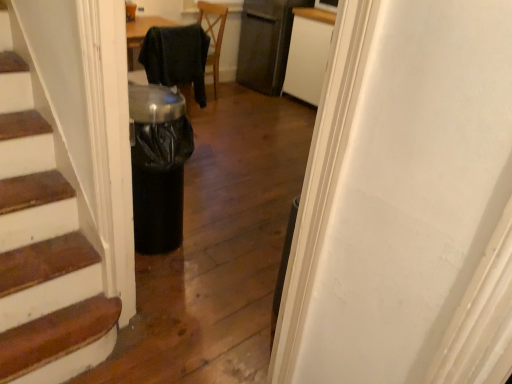
Question: From a real-world perspective, is black fabric chair at center beneath satin black refrigerator at upper center?

Choices:
 (A) yes
 (B) no

Answer: (B)

Question: Would you say black fabric chair at center contains satin black refrigerator at upper center?

Choices:
 (A) yes
 (B) no

Answer: (B)

Question: Can you confirm if black fabric chair at center is shorter than satin black refrigerator at upper center?

Choices:
 (A) yes
 (B) no

Answer: (A)

Question: Does black fabric chair at center come in front of satin black refrigerator at upper center?

Choices:
 (A) no
 (B) yes

Answer: (B)

Question: From the image's perspective, is black fabric chair at center located beneath satin black refrigerator at upper center?

Choices:
 (A) no
 (B) yes

Answer: (B)

Question: Does black fabric chair at center have a lesser width compared to satin black refrigerator at upper center?

Choices:
 (A) no
 (B) yes

Answer: (B)

Question: Is white matte cabinet at upper center positioned behind black fabric chair at center?

Choices:
 (A) yes
 (B) no

Answer: (A)

Question: Is white matte cabinet at upper center in contact with black fabric chair at center?

Choices:
 (A) yes
 (B) no

Answer: (B)

Question: Is white matte cabinet at upper center located outside black fabric chair at center?

Choices:
 (A) yes
 (B) no

Answer: (A)

Question: Is white matte cabinet at upper center at the left side of black fabric chair at center?

Choices:
 (A) yes
 (B) no

Answer: (B)

Question: Does white matte cabinet at upper center have a lesser width compared to black fabric chair at center?

Choices:
 (A) no
 (B) yes

Answer: (A)

Question: Is white matte cabinet at upper center facing towards black fabric chair at center?

Choices:
 (A) yes
 (B) no

Answer: (A)

Question: Does white matte cabinet at upper center appear on the right side of satin black refrigerator at upper center?

Choices:
 (A) no
 (B) yes

Answer: (B)